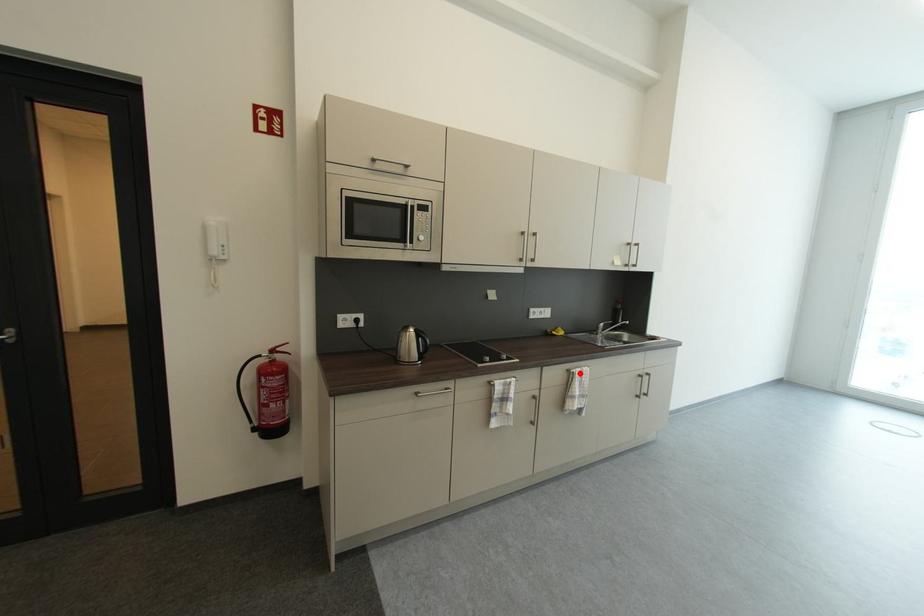
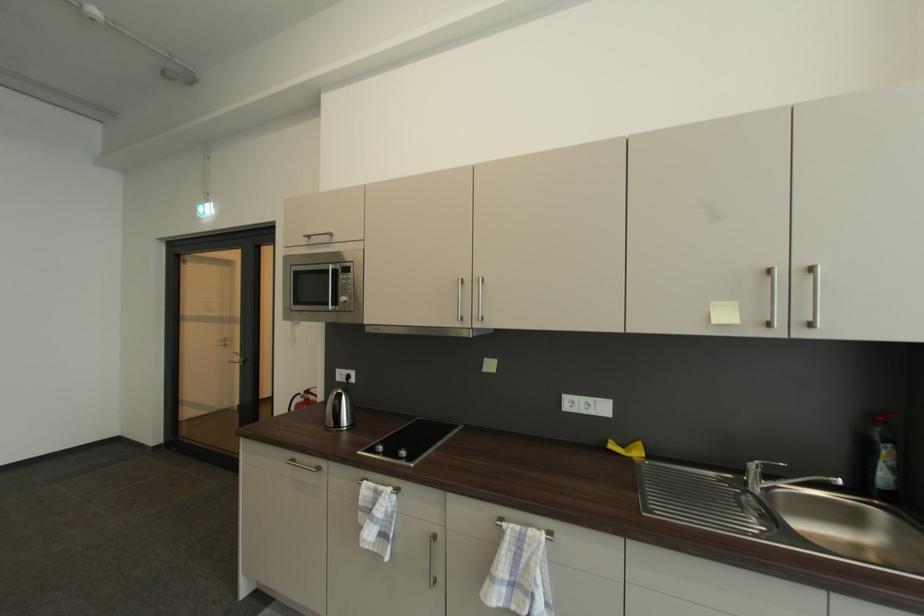
Question: I am providing you with two images of the same scene from different viewpoints. A red point is marked on the first image. Can you still see the location of the red point in image 2?

Choices:
 (A) Yes
 (B) No

Answer: (A)